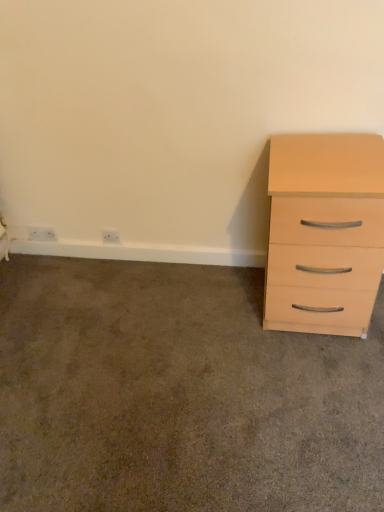
You are a GUI agent. You are given a task and a screenshot of the screen. Output one action in this format:
    pyautogui.click(x=<x>, y=<y>)
    Task: Click on the light wood/finish chest of drawers at right
    
    Given the screenshot: What is the action you would take?
    pyautogui.click(x=324, y=232)

Describe the element at coordinates (324, 232) in the screenshot. I see `light wood/finish chest of drawers at right` at that location.

This screenshot has height=512, width=384. What do you see at coordinates (178, 394) in the screenshot?
I see `beige wood drawer at right` at bounding box center [178, 394].

What do you see at coordinates (110, 236) in the screenshot?
I see `white plastic outlet at lower left, the second electric outlet from the left` at bounding box center [110, 236].

The width and height of the screenshot is (384, 512). In order to click on light wood/finish chest of drawers at right in this screenshot , I will do tap(324, 232).

Can you confirm if white plastic electric outlet at lower left, the 2th electric outlet when ordered from right to left, is positioned to the right of light wood/finish chest of drawers at right?

In fact, white plastic electric outlet at lower left, the 2th electric outlet when ordered from right to left, is to the left of light wood/finish chest of drawers at right.

The width and height of the screenshot is (384, 512). I want to click on the chest of drawers in front of the white plastic electric outlet at lower left, which ranks as the first electric outlet in left-to-right order, so [x=324, y=232].

Is white plastic electric outlet at lower left, the 2th electric outlet when ordered from right to left, wider than light wood/finish chest of drawers at right?

Incorrect, the width of white plastic electric outlet at lower left, the 2th electric outlet when ordered from right to left, does not surpass that of light wood/finish chest of drawers at right.

The image size is (384, 512). In the image, there is a beige wood drawer at right. Find the location of `the chest of drawers above it (from the image's perspective)`. the chest of drawers above it (from the image's perspective) is located at coordinates (324, 232).

Which object is positioned more to the right, beige wood drawer at right or light wood/finish chest of drawers at right?

From the viewer's perspective, light wood/finish chest of drawers at right appears more on the right side.

How far apart are beige wood drawer at right and light wood/finish chest of drawers at right?

A distance of 43.29 centimeters exists between beige wood drawer at right and light wood/finish chest of drawers at right.

Is the depth of beige wood drawer at right greater than that of light wood/finish chest of drawers at right?

No, it is not.

Can we say light wood/finish chest of drawers at right lies outside white plastic outlet at lower left, which ranks as the first electric outlet in right-to-left order?

Absolutely, light wood/finish chest of drawers at right is external to white plastic outlet at lower left, which ranks as the first electric outlet in right-to-left order.

Is light wood/finish chest of drawers at right positioned before white plastic outlet at lower left, which ranks as the first electric outlet in right-to-left order?

Yes, light wood/finish chest of drawers at right is closer to the camera.

From the image's perspective, which object appears higher, light wood/finish chest of drawers at right or white plastic outlet at lower left, the second electric outlet from the left?

white plastic outlet at lower left, the second electric outlet from the left, appears higher in the image.

The image size is (384, 512). I want to click on chest of drawers on the right of white plastic outlet at lower left, the second electric outlet from the left, so click(324, 232).

From the image's perspective, does white plastic outlet at lower left, the second electric outlet from the left, appear lower than light wood/finish chest of drawers at right?

No.

Is light wood/finish chest of drawers at right located within white plastic outlet at lower left, the second electric outlet from the left?

No.

Considering the relative sizes of white plastic outlet at lower left, which ranks as the first electric outlet in right-to-left order, and light wood/finish chest of drawers at right in the image provided, is white plastic outlet at lower left, which ranks as the first electric outlet in right-to-left order, bigger than light wood/finish chest of drawers at right?

No, white plastic outlet at lower left, which ranks as the first electric outlet in right-to-left order, is not bigger than light wood/finish chest of drawers at right.

Considering the positions of objects white plastic outlet at lower left, the second electric outlet from the left, and light wood/finish chest of drawers at right in the image provided, who is in front, white plastic outlet at lower left, the second electric outlet from the left, or light wood/finish chest of drawers at right?

light wood/finish chest of drawers at right is in front.

Which is more to the right, white plastic outlet at lower left, which ranks as the first electric outlet in right-to-left order, or white plastic electric outlet at lower left, which ranks as the first electric outlet in left-to-right order?

From the viewer's perspective, white plastic outlet at lower left, which ranks as the first electric outlet in right-to-left order, appears more on the right side.

The image size is (384, 512). Find the location of `electric outlet located on the left of white plastic outlet at lower left, which ranks as the first electric outlet in right-to-left order`. electric outlet located on the left of white plastic outlet at lower left, which ranks as the first electric outlet in right-to-left order is located at coordinates (41, 234).

Is white plastic outlet at lower left, which ranks as the first electric outlet in right-to-left order, oriented away from white plastic electric outlet at lower left, which ranks as the first electric outlet in left-to-right order?

That's not correct — white plastic outlet at lower left, which ranks as the first electric outlet in right-to-left order, is not looking away from white plastic electric outlet at lower left, which ranks as the first electric outlet in left-to-right order.

Is there a large distance between white plastic outlet at lower left, which ranks as the first electric outlet in right-to-left order, and white plastic electric outlet at lower left, the 2th electric outlet when ordered from right to left?

That's not correct — white plastic outlet at lower left, which ranks as the first electric outlet in right-to-left order, is a little close to white plastic electric outlet at lower left, the 2th electric outlet when ordered from right to left.

From a real-world perspective, between white plastic electric outlet at lower left, the 2th electric outlet when ordered from right to left, and beige wood drawer at right, who is vertically lower?

beige wood drawer at right, from a real-world perspective.

Is point (31, 226) positioned in front of point (245, 310)?

No, it is behind (245, 310).

Could you tell me if white plastic electric outlet at lower left, the 2th electric outlet when ordered from right to left, is turned towards beige wood drawer at right?

No, white plastic electric outlet at lower left, the 2th electric outlet when ordered from right to left, is not oriented towards beige wood drawer at right.

What are the coordinates of `electric outlet that is the 2nd object located above the light wood/finish chest of drawers at right (from the image's perspective)` in the screenshot? It's located at (41, 234).

Between light wood/finish chest of drawers at right and white plastic electric outlet at lower left, which ranks as the first electric outlet in left-to-right order, which one has larger size?

With larger size is light wood/finish chest of drawers at right.

Is point (351, 155) closer or farther from the camera than point (51, 238)?

Point (351, 155) appears to be closer to the viewer than point (51, 238).

Is light wood/finish chest of drawers at right at the right side of white plastic electric outlet at lower left, the 2th electric outlet when ordered from right to left?

Indeed, light wood/finish chest of drawers at right is positioned on the right side of white plastic electric outlet at lower left, the 2th electric outlet when ordered from right to left.

Where is `chest of drawers located on the right of white plastic electric outlet at lower left, the 2th electric outlet when ordered from right to left`? The height and width of the screenshot is (512, 384). chest of drawers located on the right of white plastic electric outlet at lower left, the 2th electric outlet when ordered from right to left is located at coordinates (324, 232).

Where is `concrete in front of the light wood/finish chest of drawers at right`? concrete in front of the light wood/finish chest of drawers at right is located at coordinates (178, 394).

From the image, which object appears to be nearer to beige wood drawer at right, white plastic electric outlet at lower left, the 2th electric outlet when ordered from right to left, or light wood/finish chest of drawers at right?

Based on the image, light wood/finish chest of drawers at right appears to be nearer to beige wood drawer at right.

When comparing their distances from white plastic electric outlet at lower left, which ranks as the first electric outlet in left-to-right order, does light wood/finish chest of drawers at right or white plastic outlet at lower left, the second electric outlet from the left, seem closer?

Among the two, white plastic outlet at lower left, the second electric outlet from the left, is located nearer to white plastic electric outlet at lower left, which ranks as the first electric outlet in left-to-right order.

Looking at the image, which one is located closer to light wood/finish chest of drawers at right, white plastic electric outlet at lower left, the 2th electric outlet when ordered from right to left, or beige wood drawer at right?

→ beige wood drawer at right.

From the image, which object appears to be nearer to light wood/finish chest of drawers at right, beige wood drawer at right or white plastic outlet at lower left, the second electric outlet from the left?

beige wood drawer at right.

Consider the image. Considering their positions, is white plastic outlet at lower left, which ranks as the first electric outlet in right-to-left order, positioned further to light wood/finish chest of drawers at right than beige wood drawer at right?

white plastic outlet at lower left, which ranks as the first electric outlet in right-to-left order.

Considering their positions, is light wood/finish chest of drawers at right positioned closer to white plastic outlet at lower left, the second electric outlet from the left, than white plastic electric outlet at lower left, the 2th electric outlet when ordered from right to left?

Among the two, white plastic electric outlet at lower left, the 2th electric outlet when ordered from right to left, is located nearer to white plastic outlet at lower left, the second electric outlet from the left.

From the image, which object appears to be farther from white plastic outlet at lower left, the second electric outlet from the left, beige wood drawer at right or light wood/finish chest of drawers at right?

light wood/finish chest of drawers at right lies further to white plastic outlet at lower left, the second electric outlet from the left, than the other object.

Which object lies nearer to the anchor point light wood/finish chest of drawers at right, white plastic electric outlet at lower left, which ranks as the first electric outlet in left-to-right order, or white plastic outlet at lower left, the second electric outlet from the left?

Based on the image, white plastic outlet at lower left, the second electric outlet from the left, appears to be nearer to light wood/finish chest of drawers at right.

Find the location of `electric outlet located between white plastic electric outlet at lower left, which ranks as the first electric outlet in left-to-right order, and light wood/finish chest of drawers at right in the left-right direction`. electric outlet located between white plastic electric outlet at lower left, which ranks as the first electric outlet in left-to-right order, and light wood/finish chest of drawers at right in the left-right direction is located at coordinates (110, 236).

The height and width of the screenshot is (512, 384). What are the coordinates of `electric outlet between beige wood drawer at right and white plastic electric outlet at lower left, which ranks as the first electric outlet in left-to-right order, in the front-back direction` in the screenshot? It's located at (110, 236).

The image size is (384, 512). Find the location of `chest of drawers between beige wood drawer at right and white plastic outlet at lower left, the second electric outlet from the left, from front to back`. chest of drawers between beige wood drawer at right and white plastic outlet at lower left, the second electric outlet from the left, from front to back is located at coordinates (324, 232).

Locate an element on the screen. This screenshot has width=384, height=512. concrete between white plastic electric outlet at lower left, the 2th electric outlet when ordered from right to left, and light wood/finish chest of drawers at right, in the horizontal direction is located at coordinates [178, 394].